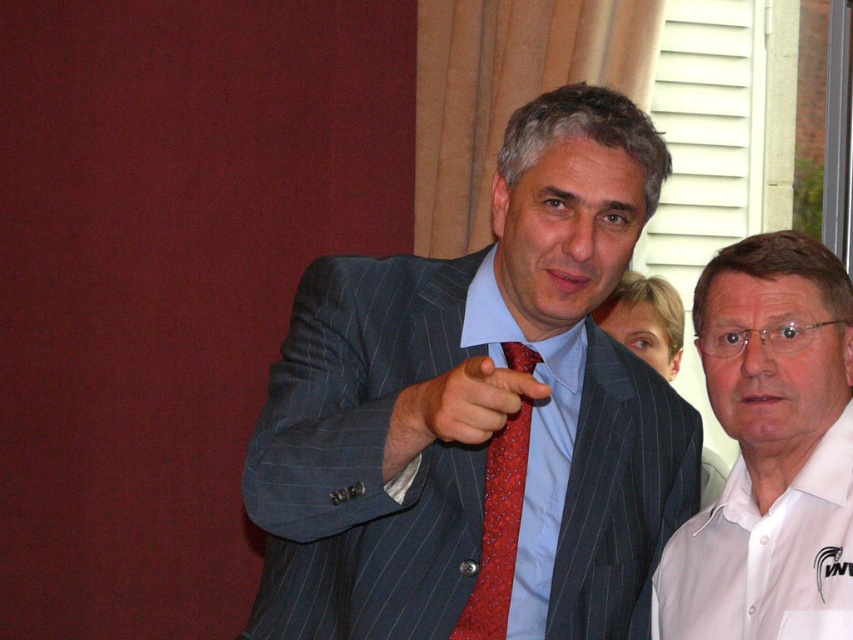
Question: Which object appears farthest from the camera in this image?

Choices:
 (A) white cotton polo shirt at lower right
 (B) red dotted fabric tie at center
 (C) pinstriped suit at center
 (D) red dotted tie at center

Answer: (B)

Question: Can you confirm if red dotted fabric tie at center is positioned to the right of red dotted tie at center?

Choices:
 (A) no
 (B) yes

Answer: (B)

Question: Does red dotted fabric tie at center have a smaller size compared to red dotted tie at center?

Choices:
 (A) no
 (B) yes

Answer: (A)

Question: Can you confirm if white cotton polo shirt at lower right is bigger than red dotted fabric tie at center?

Choices:
 (A) no
 (B) yes

Answer: (B)

Question: Which of the following is the closest to the observer?

Choices:
 (A) (502, 394)
 (B) (773, 500)
 (C) (666, 449)
 (D) (461, 625)

Answer: (A)

Question: Among these points, which one is nearest to the camera?

Choices:
 (A) (573, 580)
 (B) (514, 492)

Answer: (B)